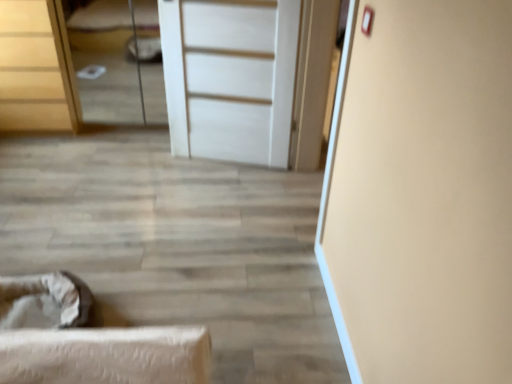
Question: Considering the relative sizes of wooden chest of drawers at upper left and white matte door at center in the image provided, is wooden chest of drawers at upper left smaller than white matte door at center?

Choices:
 (A) yes
 (B) no

Answer: (B)

Question: Can you confirm if wooden chest of drawers at upper left is positioned to the left of white matte door at center?

Choices:
 (A) no
 (B) yes

Answer: (B)

Question: Is white matte door at center located within wooden chest of drawers at upper left?

Choices:
 (A) no
 (B) yes

Answer: (A)

Question: Is wooden chest of drawers at upper left thinner than white matte door at center?

Choices:
 (A) yes
 (B) no

Answer: (B)

Question: Is wooden chest of drawers at upper left aimed at white matte door at center?

Choices:
 (A) yes
 (B) no

Answer: (B)

Question: Does wooden chest of drawers at upper left have a greater width compared to white matte door at center?

Choices:
 (A) yes
 (B) no

Answer: (A)

Question: Can white matte door at center be found inside matte white bed at upper left?

Choices:
 (A) no
 (B) yes

Answer: (A)

Question: Is matte white bed at upper left wider than white matte door at center?

Choices:
 (A) no
 (B) yes

Answer: (B)

Question: Does matte white bed at upper left have a lesser height compared to white matte door at center?

Choices:
 (A) yes
 (B) no

Answer: (A)

Question: From the image's perspective, does matte white bed at upper left appear lower than white matte door at center?

Choices:
 (A) yes
 (B) no

Answer: (B)

Question: Does matte white bed at upper left lie behind white matte door at center?

Choices:
 (A) no
 (B) yes

Answer: (B)

Question: From the image's perspective, would you say matte white bed at upper left is positioned over white matte door at center?

Choices:
 (A) no
 (B) yes

Answer: (B)

Question: Is white matte door at center positioned in front of wooden chest of drawers at upper left?

Choices:
 (A) yes
 (B) no

Answer: (A)